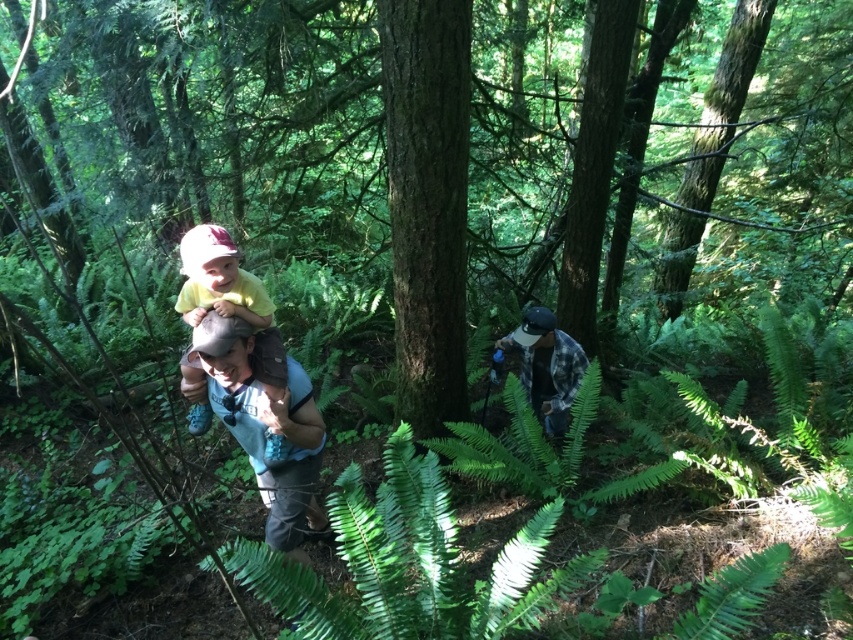
Does green rough bark tree at center lie behind denim jacket at center?

Yes, it is.

Between point (453, 289) and point (293, 385), which one is positioned behind?

The point (453, 289) is more distant.

The height and width of the screenshot is (640, 853). Identify the location of green rough bark tree at center. (427, 202).

Is denim jacket at center to the left of green leafy fern at center from the viewer's perspective?

Indeed, denim jacket at center is positioned on the left side of green leafy fern at center.

Is denim jacket at center to the right of green leafy fern at center from the viewer's perspective?

In fact, denim jacket at center is to the left of green leafy fern at center.

Who is more distant from viewer, (234, 364) or (520, 467)?

Point (520, 467)

Identify the location of denim jacket at center. The width and height of the screenshot is (853, 640). (265, 429).

Is green leafy fern at center positioned at the back of yellow matte shirt at center?

Yes.

Is green leafy fern at center below yellow matte shirt at center?

Yes, green leafy fern at center is below yellow matte shirt at center.

You are a GUI agent. You are given a task and a screenshot of the screen. Output one action in this format:
    pyautogui.click(x=<x>, y=<y>)
    Task: Click on the green leafy fern at center
    
    Given the screenshot: What is the action you would take?
    pyautogui.click(x=523, y=444)

What are the coordinates of `green leafy fern at center` in the screenshot? It's located at (523, 444).